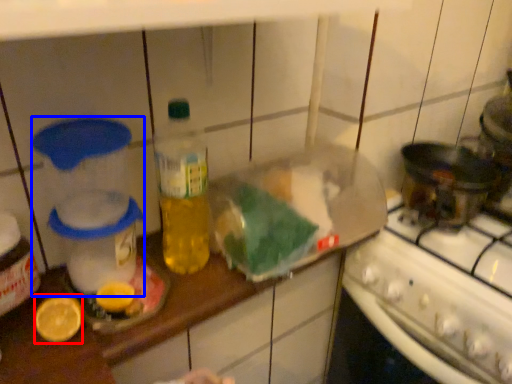
Question: Among these objects, which one is nearest to the camera, lemon (highlighted by a red box) or appliance (highlighted by a blue box)?

Choices:
 (A) lemon
 (B) appliance

Answer: (B)